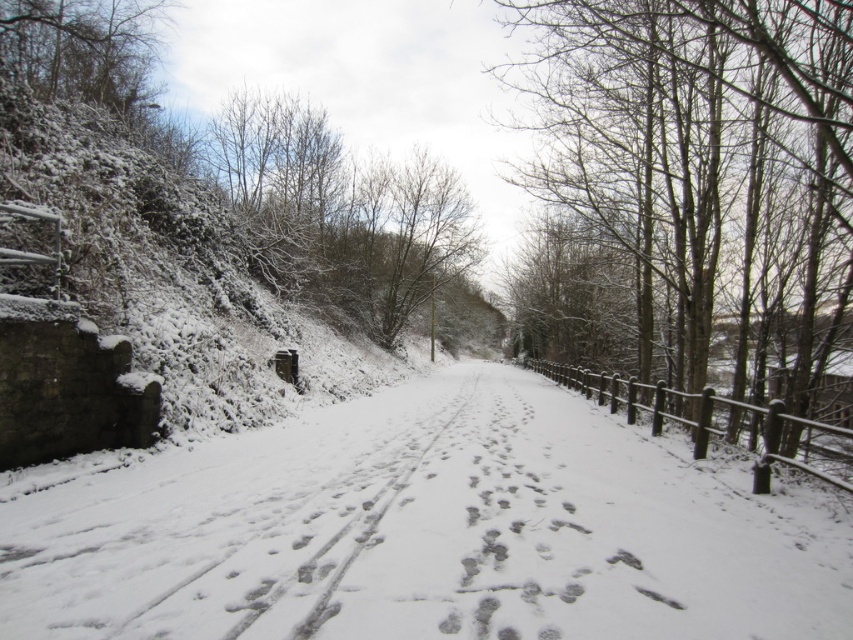
Is white powdery snow at center in front of snow-covered wooden fence at right?

Yes, white powdery snow at center is in front of snow-covered wooden fence at right.

Which is behind, point (401, 572) or point (799, 74)?

The point (799, 74) is behind.

Image resolution: width=853 pixels, height=640 pixels. Describe the element at coordinates (428, 531) in the screenshot. I see `white powdery snow at center` at that location.

The image size is (853, 640). Identify the location of white powdery snow at center. (428, 531).